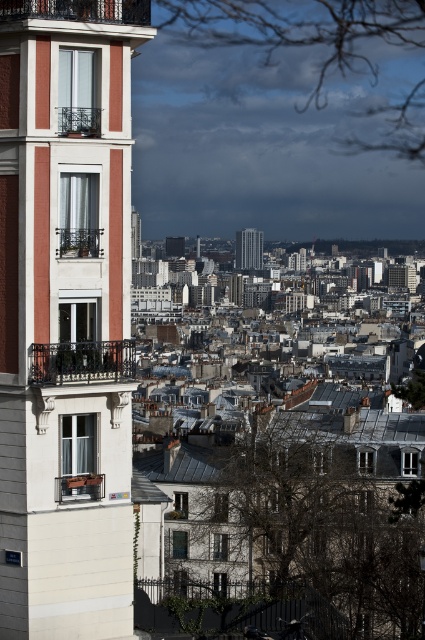
You are an architect assessing the spatial compatibility of a new balcony design. You observe the matte wood balcony at lower left and the silver metallic skyscraper at center in the cityscape. Which object is more suitable for a design that requires a compact footprint?

The matte wood balcony at lower left has a smaller size compared to the silver metallic skyscraper at center, making it more suitable for a design that requires a compact footprint.

You are an architect analyzing the city layout. You notice the white painted concrete building at center and the silver metallic skyscraper at center. Which of these two structures is closer to your current viewpoint?

The white painted concrete building at center is closer to your current viewpoint because it is positioned in front of the silver metallic skyscraper at center.